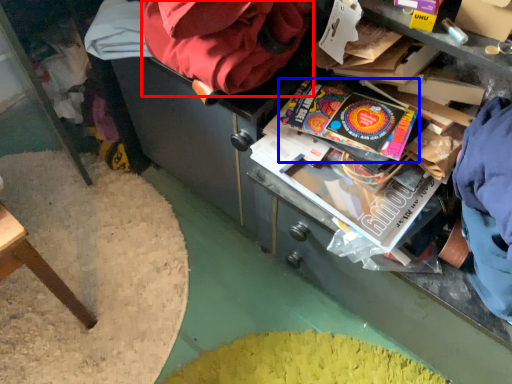
Question: Among these objects, which one is nearest to the camera, bean bag chair (highlighted by a red box) or paperback book (highlighted by a blue box)?

Choices:
 (A) bean bag chair
 (B) paperback book

Answer: (A)